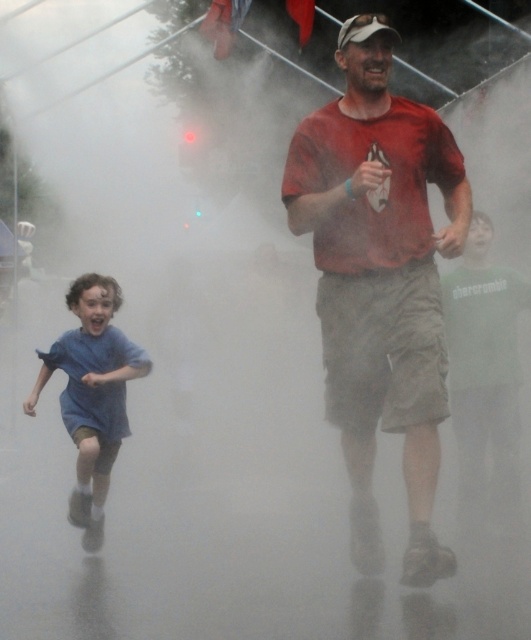
You are a photographer trying to capture the two runners in the scene. You want to position your camera so that the matte red shirt at center and the blue cotton shirt at left are both visible. According to their positions, which shirt should you place on the right side of your frame?

The matte red shirt at center should be placed on the right side of your frame because it is to the right of the blue cotton shirt at left.

You are a photographer trying to capture a photo of the matte red shirt at center and the blue cotton shirt at left. Since you want to ensure both subjects are in focus, you need to know which one is closer to the camera. Can you determine which shirt is closer based on their heights in the image?

The matte red shirt at center is taller than the blue cotton shirt at left, so the matte red shirt at center is closer to the camera than the blue cotton shirt at left.

You are a photographer trying to capture the two runners in the scene. Since the matte red shirt at center and the blue cotton shirt at left are both in your view, which one is positioned higher from the ground? Please answer based on their spatial relationship.

The matte red shirt at center is located above the blue cotton shirt at left, so the matte red shirt at center is positioned higher from the ground.